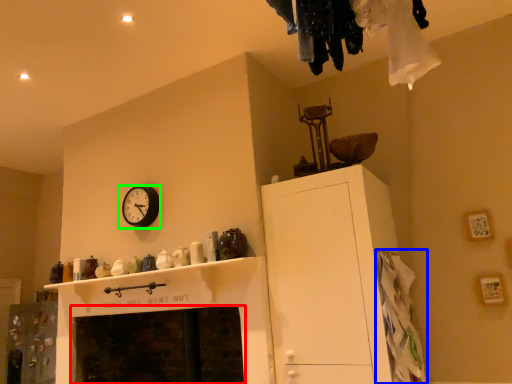
Question: Considering the real-world distances, which object is closest to fireplace (highlighted by a red box)? clothing (highlighted by a blue box) or wall clock (highlighted by a green box).

Choices:
 (A) clothing
 (B) wall clock

Answer: (B)